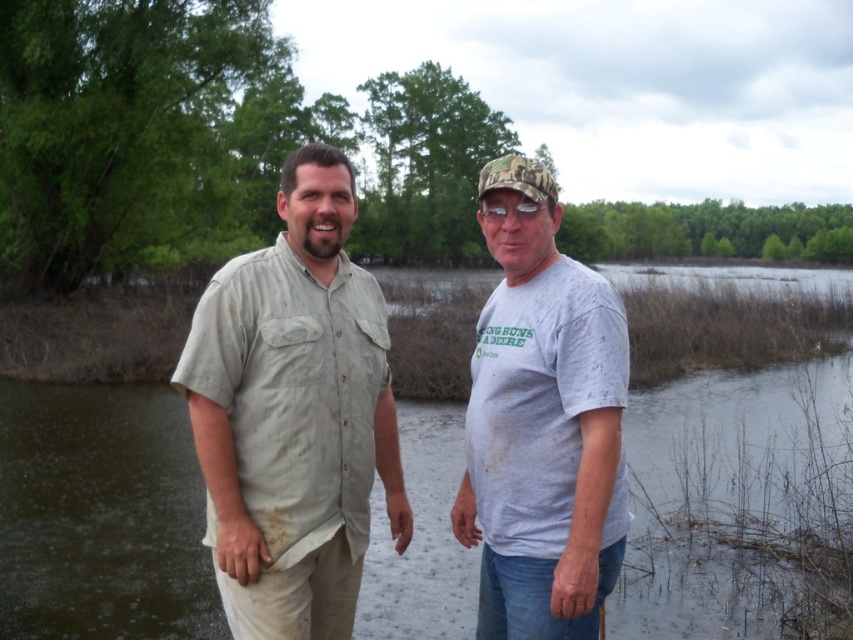
Question: Which of the following is the farthest from the observer?

Choices:
 (A) brown muddy water at center
 (B) light beige cotton shirt at center
 (C) white cotton t-shirt at center

Answer: (A)

Question: Which point appears farthest from the camera in this image?

Choices:
 (A) (486, 336)
 (B) (45, 499)

Answer: (B)

Question: Can you confirm if light beige cotton shirt at center is positioned to the left of white cotton t-shirt at center?

Choices:
 (A) no
 (B) yes

Answer: (B)

Question: From the image, what is the correct spatial relationship of brown muddy water at center in relation to light beige cotton shirt at center?

Choices:
 (A) below
 (B) above

Answer: (A)

Question: Among these points, which one is farthest from the camera?

Choices:
 (A) (471, 540)
 (B) (386, 324)
 (C) (109, 397)

Answer: (C)

Question: Does brown muddy water at center have a greater width compared to light beige cotton shirt at center?

Choices:
 (A) no
 (B) yes

Answer: (B)